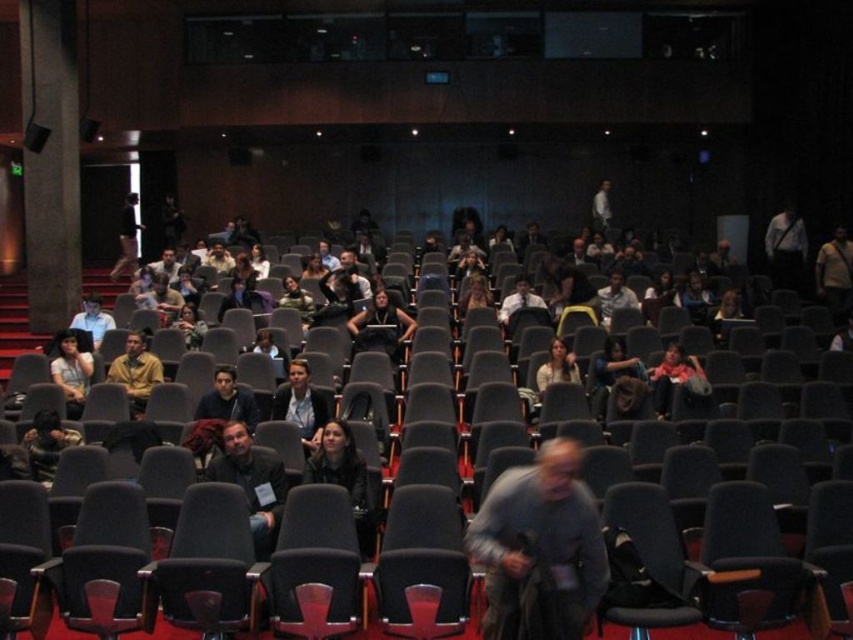
Which is below, light brown leather jacket at center or dark brown leather jacket at upper center?

light brown leather jacket at center is lower down.

Who is more distant from viewer, (842,241) or (115,260)?

The point (115,260) is behind.

Find the location of a particular element. Image resolution: width=853 pixels, height=640 pixels. light brown leather jacket at center is located at coordinates (834, 272).

Is white shirt at upper right taller than dark brown leather jacket at upper center?

Incorrect, white shirt at upper right's height is not larger of dark brown leather jacket at upper center's.

Is white shirt at upper right above dark brown leather jacket at upper center?

No, white shirt at upper right is not above dark brown leather jacket at upper center.

Does point (775, 228) come in front of point (120, 230)?

Yes, point (775, 228) is closer to viewer.

The width and height of the screenshot is (853, 640). In order to click on white shirt at upper right in this screenshot , I will do [785, 248].

Is point (561, 611) farther from camera compared to point (86, 328)?

No, (561, 611) is in front of (86, 328).

Can you confirm if gray fabric jacket at center is wider than matte black laptop at center?

Indeed, gray fabric jacket at center has a greater width compared to matte black laptop at center.

Who is more distant from viewer, [480,540] or [96,339]?

The point [96,339] is more distant.

The width and height of the screenshot is (853, 640). I want to click on gray fabric jacket at center, so click(x=538, y=548).